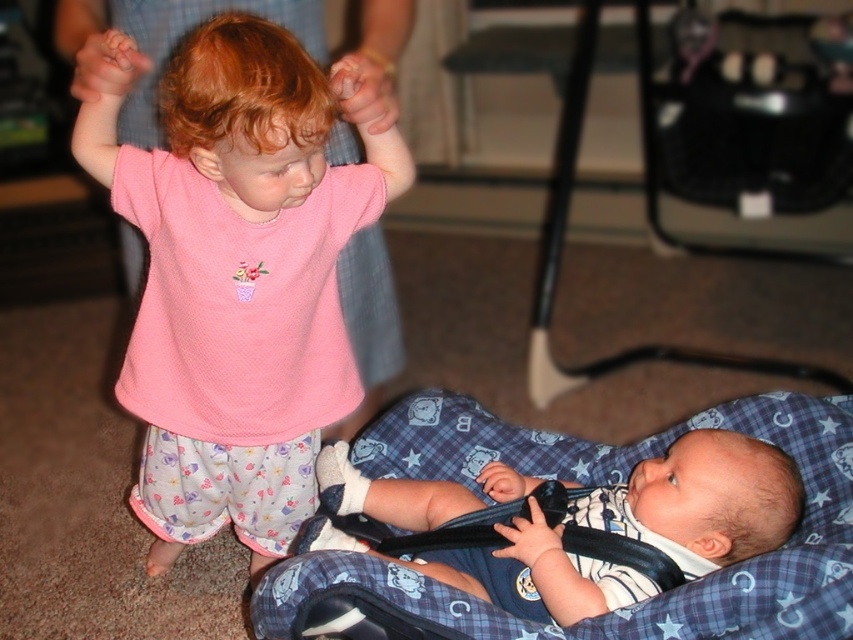
You are a photographer trying to capture a photo of the soft blue fabric at center without the pink mesh shirt at upper left blocking it. What should you do?

The pink mesh shirt at upper left is positioned over the soft blue fabric at center, so you should move the camera angle downward to avoid the pink mesh shirt at upper left blocking the view of the soft blue fabric at center.

You are a photographer taking a picture of the two children in the scene. You need to ensure that both the pink mesh shirt at upper left and the soft blue fabric at center are clearly visible in the frame. Given their height difference, which child should you adjust the camera angle to focus on first?

The pink mesh shirt at upper left is much taller than the soft blue fabric at center, so you should first adjust the camera angle to focus on the pink mesh shirt at upper left to ensure it is in frame, then lower the angle slightly to include the soft blue fabric at center.

You are a photographer setting up for a family photo. You need to position a light to the right of the soft blue fabric at center so it doesn t cast a shadow on the pink mesh shirt at upper left. Can you do that?

Yes, since the pink mesh shirt at upper left is to the left of the soft blue fabric at center, placing the light to the right of the soft blue fabric at center will avoid casting a shadow on the pink mesh shirt at upper left.